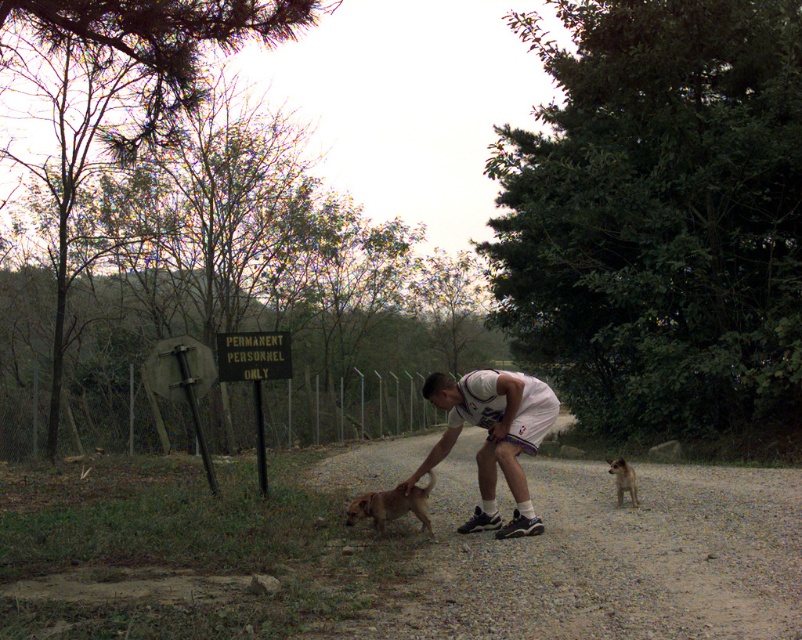
Question: Is green plastic sign at center behind brown furry dog at center?

Choices:
 (A) no
 (B) yes

Answer: (B)

Question: Which object appears closest to the camera in this image?

Choices:
 (A) white athletic wear at center
 (B) green plastic sign at center
 (C) dirt gravel road at center

Answer: (C)

Question: Is green plastic sign at center smaller than brown furry dog at center?

Choices:
 (A) no
 (B) yes

Answer: (A)

Question: Which point appears farthest from the camera in this image?

Choices:
 (A) (350, 452)
 (B) (497, 426)
 (C) (630, 483)
 (D) (260, 342)

Answer: (A)

Question: Is the position of dirt gravel road at center more distant than that of green plastic sign at center?

Choices:
 (A) yes
 (B) no

Answer: (B)

Question: Which point is closer to the camera taking this photo?

Choices:
 (A) (638, 502)
 (B) (520, 532)

Answer: (B)